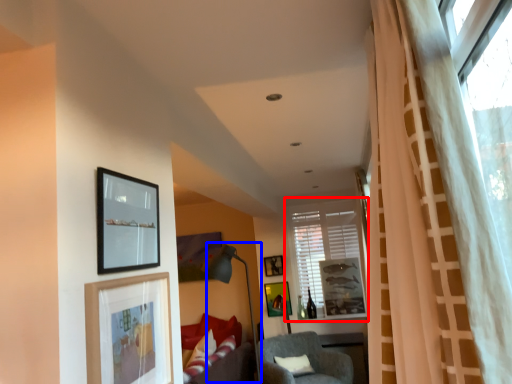
Question: Which object is further to the camera taking this photo, window (highlighted by a red box) or lamp (highlighted by a blue box)?

Choices:
 (A) window
 (B) lamp

Answer: (A)